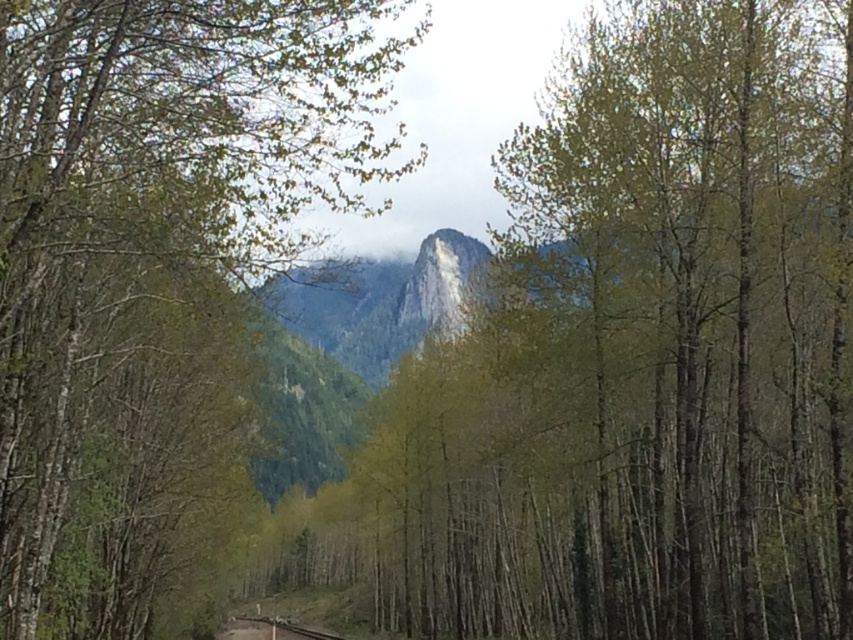
Question: Does green leafy tree at center have a lesser width compared to smooth metal train track at lower center?

Choices:
 (A) yes
 (B) no

Answer: (B)

Question: Which of the following is the closest to the observer?

Choices:
 (A) green leafy tree at center
 (B) smooth metal train track at lower center

Answer: (A)

Question: Which point is closer to the camera?

Choices:
 (A) [329, 131]
 (B) [270, 620]

Answer: (A)

Question: Which of the following is the closest to the observer?

Choices:
 (A) green leafy tree at center
 (B) smooth metal train track at lower center

Answer: (A)

Question: Is green leafy tree at center below smooth metal train track at lower center?

Choices:
 (A) yes
 (B) no

Answer: (B)

Question: Is green leafy tree at center positioned in front of smooth metal train track at lower center?

Choices:
 (A) no
 (B) yes

Answer: (B)